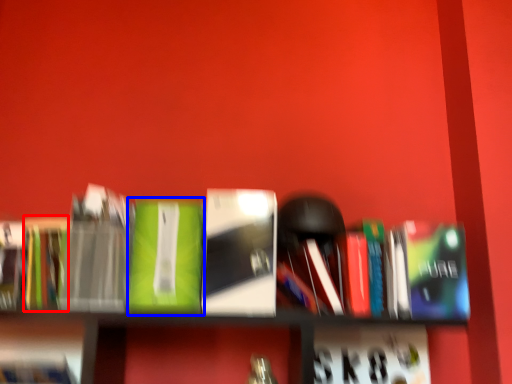
Question: Among these objects, which one is farthest to the camera, paperback book (highlighted by a red box) or book (highlighted by a blue box)?

Choices:
 (A) paperback book
 (B) book

Answer: (A)